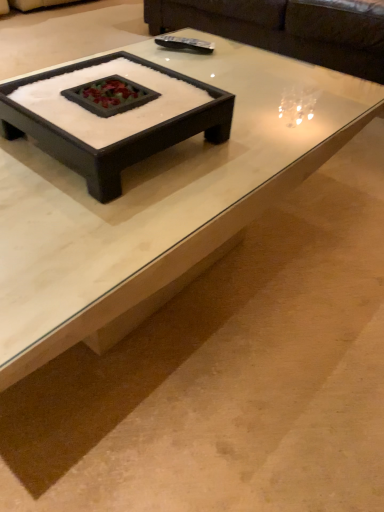
Question: Considering the relative sizes of black matte tray at center, the second coffee table in the front-to-back sequence, and white glossy coffee table at center, which appears as the first coffee table when viewed from the front, in the image provided, is black matte tray at center, the second coffee table in the front-to-back sequence, bigger than white glossy coffee table at center, which appears as the first coffee table when viewed from the front,?

Choices:
 (A) yes
 (B) no

Answer: (B)

Question: From a real-world perspective, is black matte tray at center, placed as the 1th coffee table when sorted from back to front, physically below white glossy coffee table at center, which appears as the first coffee table when viewed from the front?

Choices:
 (A) no
 (B) yes

Answer: (A)

Question: From a real-world perspective, is black matte tray at center, placed as the 1th coffee table when sorted from back to front, positioned over white glossy coffee table at center, the 2th coffee table viewed from the back, based on gravity?

Choices:
 (A) yes
 (B) no

Answer: (A)

Question: Is black matte tray at center, the second coffee table in the front-to-back sequence, next to white glossy coffee table at center, which appears as the first coffee table when viewed from the front, and touching it?

Choices:
 (A) yes
 (B) no

Answer: (B)

Question: Can you confirm if black matte tray at center, the second coffee table in the front-to-back sequence, is smaller than white glossy coffee table at center, which appears as the first coffee table when viewed from the front?

Choices:
 (A) no
 (B) yes

Answer: (B)

Question: Is the depth of black matte tray at center, placed as the 1th coffee table when sorted from back to front, less than that of white glossy coffee table at center, the 2th coffee table viewed from the back?

Choices:
 (A) yes
 (B) no

Answer: (B)

Question: Would you say white glossy coffee table at center, the 2th coffee table viewed from the back, is outside black matte tray at center, placed as the 1th coffee table when sorted from back to front?

Choices:
 (A) no
 (B) yes

Answer: (B)

Question: Can you confirm if white glossy coffee table at center, the 2th coffee table viewed from the back, is smaller than black matte tray at center, placed as the 1th coffee table when sorted from back to front?

Choices:
 (A) yes
 (B) no

Answer: (B)

Question: Can you confirm if white glossy coffee table at center, which appears as the first coffee table when viewed from the front, is bigger than black matte tray at center, placed as the 1th coffee table when sorted from back to front?

Choices:
 (A) yes
 (B) no

Answer: (A)

Question: Does white glossy coffee table at center, which appears as the first coffee table when viewed from the front, come behind black matte tray at center, the second coffee table in the front-to-back sequence?

Choices:
 (A) yes
 (B) no

Answer: (B)

Question: From a real-world perspective, is white glossy coffee table at center, which appears as the first coffee table when viewed from the front, located higher than black matte tray at center, the second coffee table in the front-to-back sequence?

Choices:
 (A) yes
 (B) no

Answer: (B)

Question: Is white glossy coffee table at center, the 2th coffee table viewed from the back, beside black matte tray at center, placed as the 1th coffee table when sorted from back to front?

Choices:
 (A) no
 (B) yes

Answer: (A)

Question: Can you confirm if dark brown leather couch at upper center is smaller than black matte tray at center, the second coffee table in the front-to-back sequence?

Choices:
 (A) yes
 (B) no

Answer: (B)